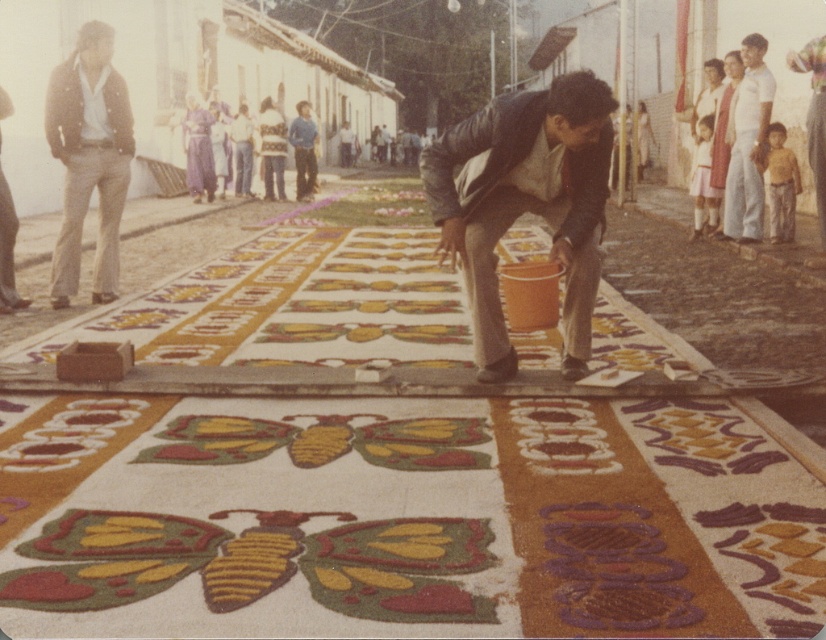
Between multicolored sand art at center and light brown denim pants at left, which one is positioned higher?

light brown denim pants at left is above.

Is point (178, 596) farther from camera compared to point (95, 65)?

No.

Is point (451, 582) farther from viewer compared to point (95, 104)?

No, it is not.

Where is `multicolored sand art at center`? multicolored sand art at center is located at coordinates (404, 516).

Is point (485, 262) more distant than point (51, 128)?

No, (485, 262) is closer to viewer.

Between matte black jacket at center and light brown denim pants at left, which one is positioned higher?

light brown denim pants at left

You are a GUI agent. You are given a task and a screenshot of the screen. Output one action in this format:
    pyautogui.click(x=<x>, y=<y>)
    Task: Click on the matte black jacket at center
    This screenshot has height=640, width=826.
    Given the screenshot: What is the action you would take?
    pyautogui.click(x=525, y=204)

Who is more distant from viewer, (741,428) or (563,269)?

The point (563,269) is more distant.

Between point (468, 634) and point (587, 77), which one is positioned in front?

Positioned in front is point (468, 634).

Where is `multicolored sand art at center`? The height and width of the screenshot is (640, 826). multicolored sand art at center is located at coordinates (404, 516).